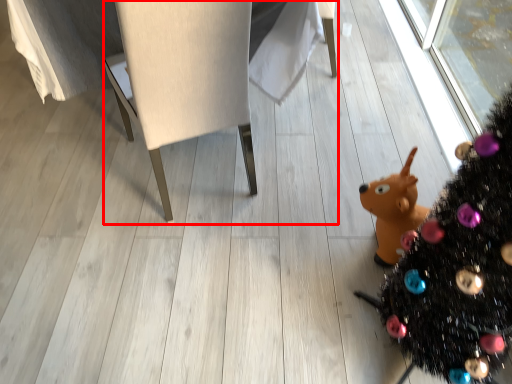
Question: Considering the relative positions of furniture (annotated by the red box) and christmas tree in the image provided, where is furniture (annotated by the red box) located with respect to the staircase?

Choices:
 (A) right
 (B) left

Answer: (B)